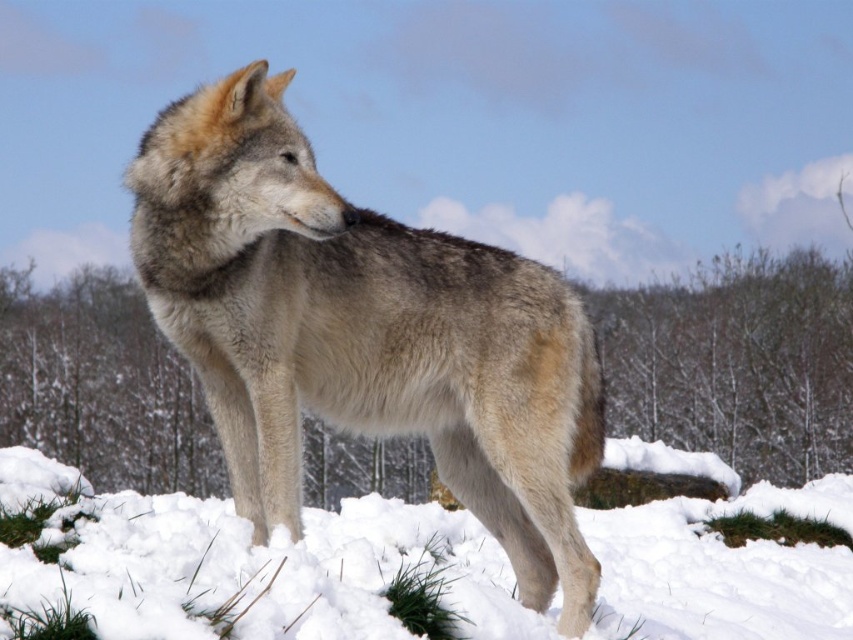
You are a photographer trying to capture a closeup of the fuzzy fur wolf at center. You need to be within 5 meters to get a clear shot. Can you get close enough?

The fuzzy fur wolf at center and camera are 5.34 meters apart from each other. Since the required distance is within 5 meters, the photographer cannot get close enough for a clear shot.

You are a wildlife photographer trying to capture a closeup shot of the fuzzy fur wolf at center. Your camera can focus on subjects within 5 feet. Is the white fluffy snow at lower center too far away for your camera to focus on the wolf?

The fuzzy fur wolf at center and white fluffy snow at lower center are 5.17 feet apart. Since the camera can focus within 5 feet, the distance between them is slightly beyond the camera focus range, so the snow is too far away for the camera to focus on the wolf.